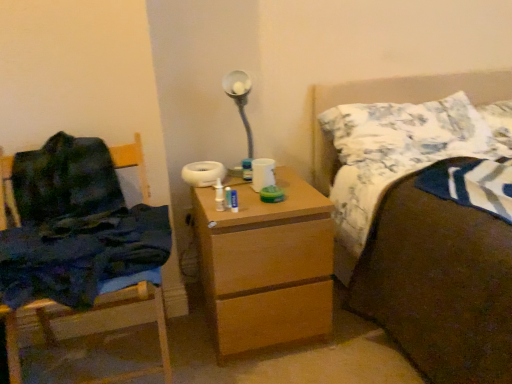
Question: Looking at their shapes, would you say brown fabric bed at upper right is wider or thinner than white textured pillow at upper right, which ranks as the second pillow in right-to-left order?

Choices:
 (A) thin
 (B) wide

Answer: (B)

Question: From a real-world perspective, relative to white textured pillow at upper right, which appears as the 1th pillow when viewed from the left, is brown fabric bed at upper right vertically above or below?

Choices:
 (A) above
 (B) below

Answer: (B)

Question: Which is farther from the white cotton pillow at upper right, the first pillow in the right-to-left sequence?

Choices:
 (A) dark blue fabric at left
 (B) white textured pillow at upper right, which ranks as the second pillow in right-to-left order
 (C) wooden chair at left
 (D) wooden chest of drawers at center
 (E) brown fabric bed at upper right

Answer: (C)

Question: Which object is positioned farthest from the wooden chair at left?

Choices:
 (A) white textured pillow at upper right, which ranks as the second pillow in right-to-left order
 (B) white cotton pillow at upper right, the first pillow in the right-to-left sequence
 (C) dark blue fabric at left
 (D) wooden chest of drawers at center
 (E) brown fabric bed at upper right

Answer: (B)